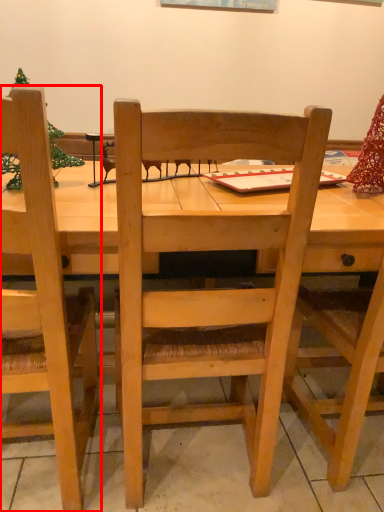
Question: Considering the relative positions of chair (annotated by the red box) and chair in the image provided, where is chair (annotated by the red box) located with respect to the staircase?

Choices:
 (A) right
 (B) left

Answer: (B)